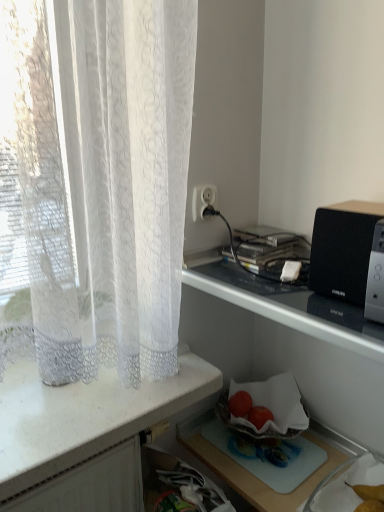
You are a GUI agent. You are given a task and a screenshot of the screen. Output one action in this format:
    pyautogui.click(x=<x>, y=<y>)
    Task: Click on the free location in front of red matte tomato at lower center, marked as the 2th fruit in a right-to-left arrangement
    The height and width of the screenshot is (512, 384).
    Given the screenshot: What is the action you would take?
    pyautogui.click(x=258, y=454)